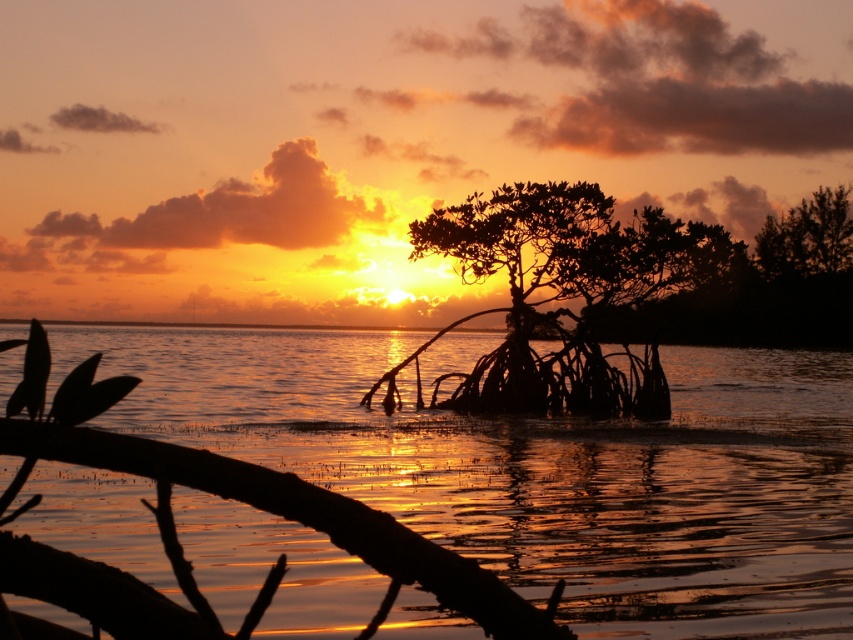
You are standing on a boat in the middle of the lagoon and see the glistening water at center and the silhouette wood at center. Which object is nearer to you?

The glistening water at center is closer to the viewer than the silhouette wood at center.

From the picture: You are a kayaker planning to paddle between the glistening water at center and the silhouette wood at center. Given that your kayak requires a minimum of 70 feet of space to maneuver safely, can you navigate through the gap between them?

The distance between the glistening water at center and the silhouette wood at center is 75.52 feet, which exceeds the required 70 feet for safe maneuvering. Therefore, you can safely navigate through the gap between them.